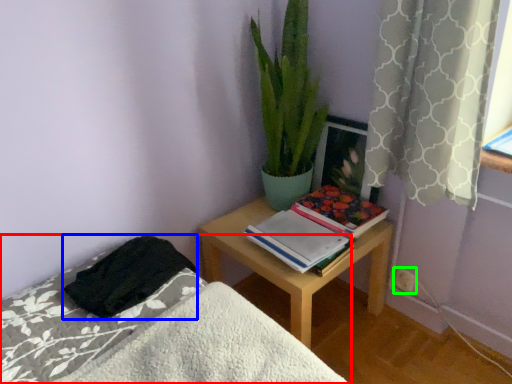
Question: Considering the real-world distances, which object is closest to bed (highlighted by a red box)? blanket (highlighted by a blue box) or electric outlet (highlighted by a green box).

Choices:
 (A) blanket
 (B) electric outlet

Answer: (A)